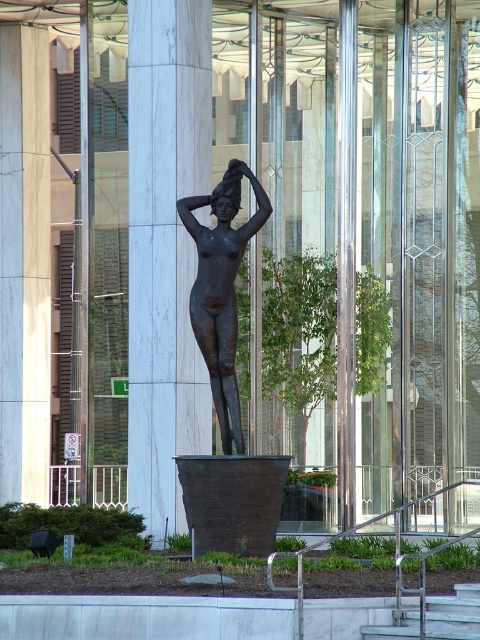
Question: Observing the image, what is the correct spatial positioning of matte white column at center in reference to metallic gray stairs at lower center?

Choices:
 (A) left
 (B) right

Answer: (A)

Question: Can you confirm if matte white column at center is positioned above metallic gray stairs at lower center?

Choices:
 (A) yes
 (B) no

Answer: (A)

Question: Can you confirm if matte white column at center is positioned above metallic gray stairs at lower center?

Choices:
 (A) no
 (B) yes

Answer: (B)

Question: Which object appears closest to the camera in this image?

Choices:
 (A) matte white column at center
 (B) bronze statue at center
 (C) metallic gray stairs at lower center

Answer: (C)

Question: Estimate the real-world distances between objects in this image. Which object is farther from the metallic gray stairs at lower center?

Choices:
 (A) bronze statue at center
 (B) matte white column at center

Answer: (B)

Question: Which of these objects is positioned farthest from the bronze statue at center?

Choices:
 (A) metallic gray stairs at lower center
 (B) matte white column at center

Answer: (B)